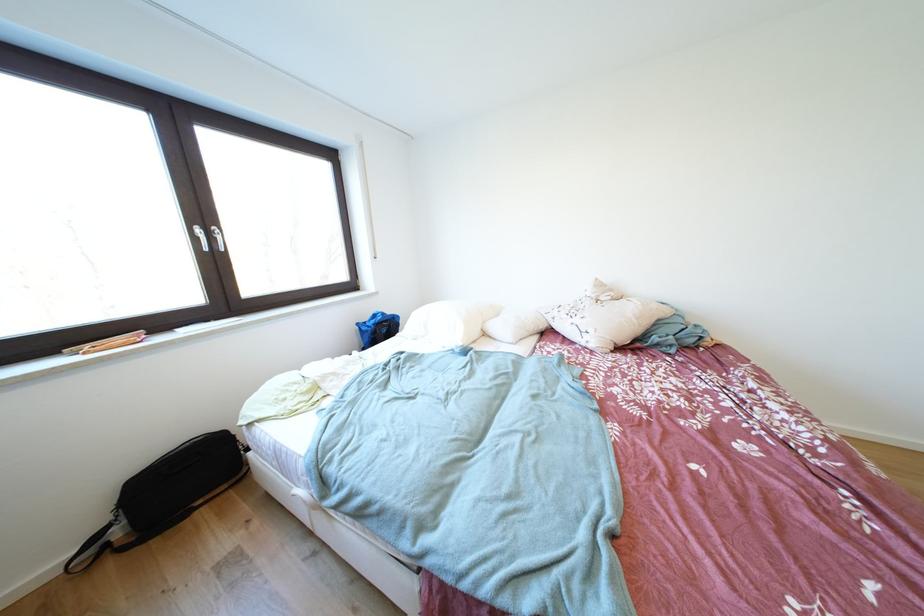
The location [284,389] corresponds to which object?

It corresponds to the pencil in the image.